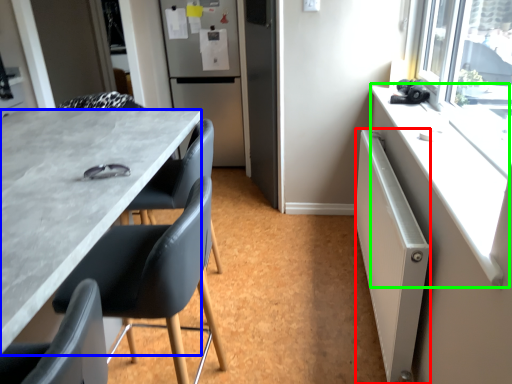
Question: Which object is the farthest from radiator (highlighted by a red box)? Choose among these: desk (highlighted by a blue box) or counter top (highlighted by a green box).

Choices:
 (A) desk
 (B) counter top

Answer: (A)